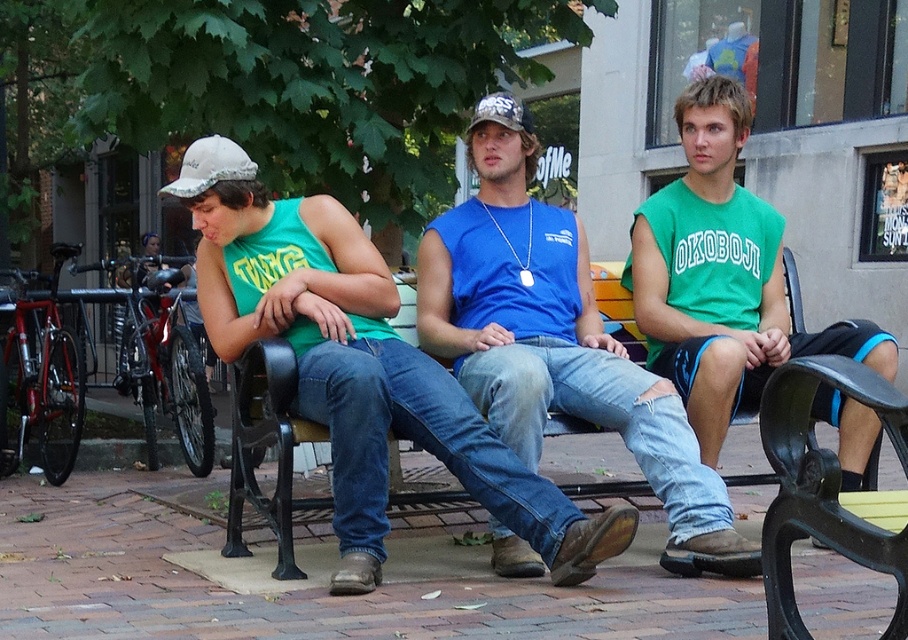
Is matte green tank top at left smaller than yellow painted wood bench at center?

No, matte green tank top at left is not smaller than yellow painted wood bench at center.

Which is below, matte green tank top at left or yellow painted wood bench at center?

yellow painted wood bench at center is below.

Where is `matte green tank top at left`? matte green tank top at left is located at coordinates (368, 378).

Which is above, yellow painted wood bench at center or white fabric baseball cap at left?

white fabric baseball cap at left is above.

Which is behind, point (793, 289) or point (183, 188)?

The point (793, 289) is more distant.

The height and width of the screenshot is (640, 908). Find the location of `yellow painted wood bench at center`. yellow painted wood bench at center is located at coordinates (265, 449).

Can you confirm if matte green tank top at left is bigger than green cotton shirt at center?

Yes, matte green tank top at left is bigger than green cotton shirt at center.

Looking at this image, between matte green tank top at left and green cotton shirt at center, which one appears on the right side from the viewer's perspective?

From the viewer's perspective, green cotton shirt at center appears more on the right side.

This screenshot has width=908, height=640. I want to click on matte green tank top at left, so click(368, 378).